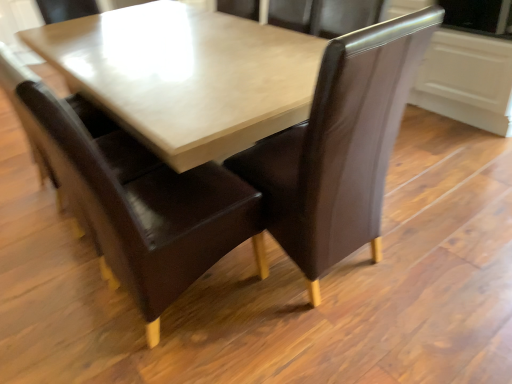
The height and width of the screenshot is (384, 512). I want to click on free space between brown leather chair at center, the 2th chair in the right-to-left sequence, and brown leather chair at center, which appears as the second chair when viewed from the left, so click(x=249, y=328).